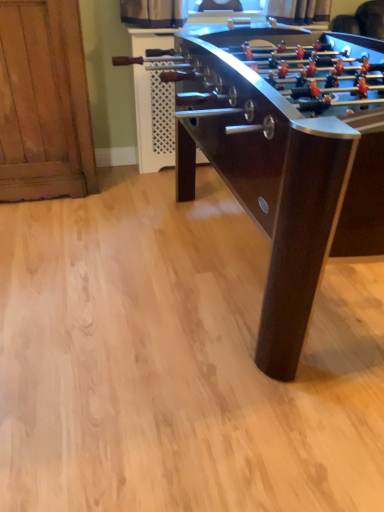
At what (x,y) coordinates should I click in order to perform the action: click on free space to the left of dark brown wood foosball table at center. Please return your answer as a coordinate pair (x, y). This screenshot has width=384, height=512. Looking at the image, I should click on (73, 264).